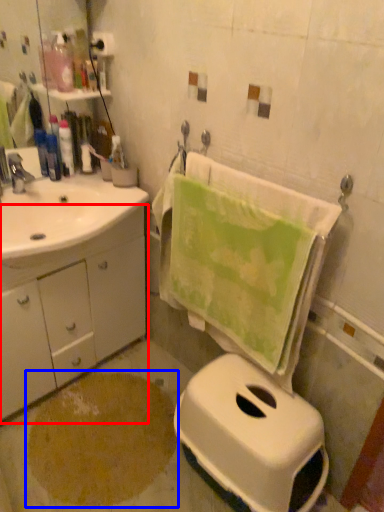
Question: Among these objects, which one is nearest to the camera, bathroom cabinet (highlighted by a red box) or powder (highlighted by a blue box)?

Choices:
 (A) bathroom cabinet
 (B) powder

Answer: (A)